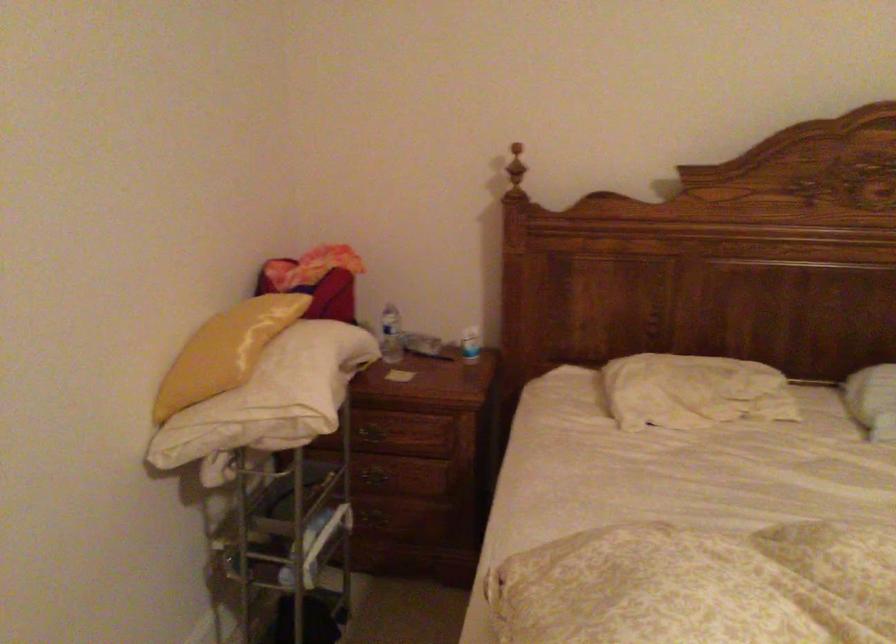
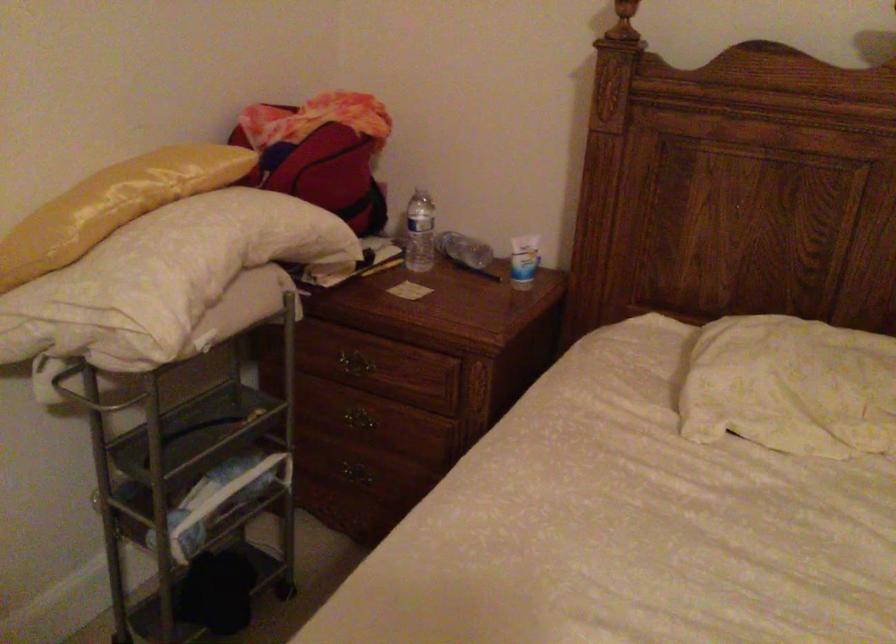
Find the pixel in the second image that matches (x=254, y=345) in the first image.

(113, 205)